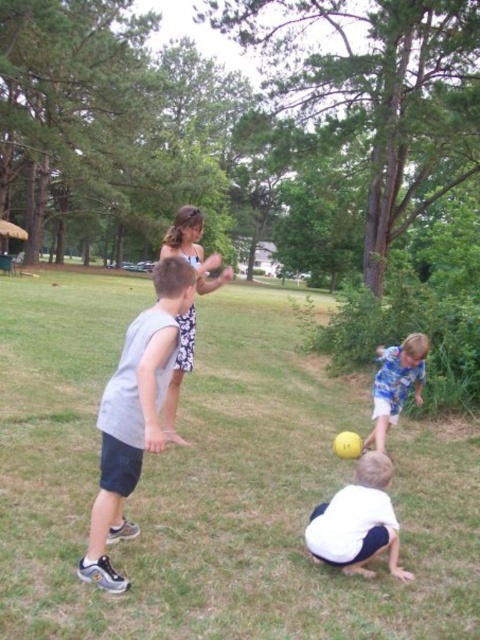
What do you see at coordinates (358, 522) in the screenshot? Image resolution: width=480 pixels, height=640 pixels. I see `white matte shirt at lower center` at bounding box center [358, 522].

You are a GUI agent. You are given a task and a screenshot of the screen. Output one action in this format:
    pyautogui.click(x=<x>, y=<y>)
    Task: Click on the white matte shirt at lower center
    The height and width of the screenshot is (640, 480).
    Given the screenshot: What is the action you would take?
    pyautogui.click(x=358, y=522)

This screenshot has width=480, height=640. In order to click on green grass at center in this screenshot , I will do `click(214, 483)`.

Who is more distant from viewer, [40,579] or [372,477]?

The point [372,477] is behind.

Is point (273, 445) behind point (385, 470)?

Yes, it is.

Where is `green grass at center`? green grass at center is located at coordinates (214, 483).

Which of these two, gray fabric shirt at center or white matte shirt at lower center, stands shorter?

white matte shirt at lower center is shorter.

What do you see at coordinates (133, 416) in the screenshot?
I see `gray fabric shirt at center` at bounding box center [133, 416].

Image resolution: width=480 pixels, height=640 pixels. Describe the element at coordinates (133, 416) in the screenshot. I see `gray fabric shirt at center` at that location.

Locate an element on the screen. The image size is (480, 640). gray fabric shirt at center is located at coordinates (133, 416).